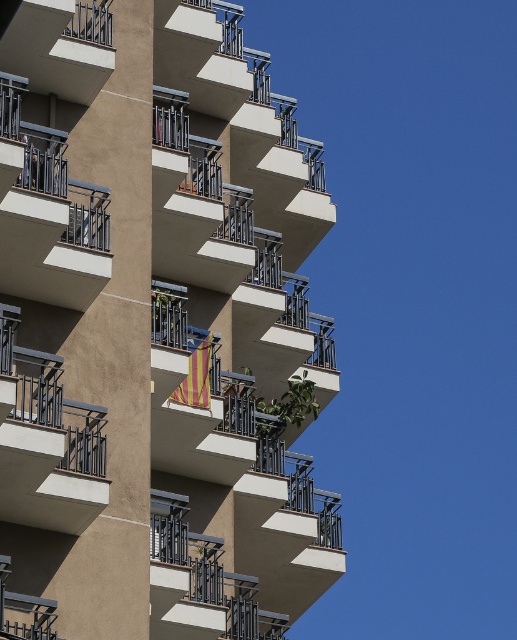
Question: Is smooth concrete balcony at center to the right of striped fabric flag at center from the viewer's perspective?

Choices:
 (A) yes
 (B) no

Answer: (B)

Question: Which point appears closest to the camera in this image?

Choices:
 (A) (100, 141)
 (B) (208, 401)

Answer: (B)

Question: Where is smooth concrete balcony at center located in relation to striped fabric flag at center in the image?

Choices:
 (A) right
 (B) left

Answer: (B)

Question: Does smooth concrete balcony at center have a smaller size compared to striped fabric flag at center?

Choices:
 (A) yes
 (B) no

Answer: (B)